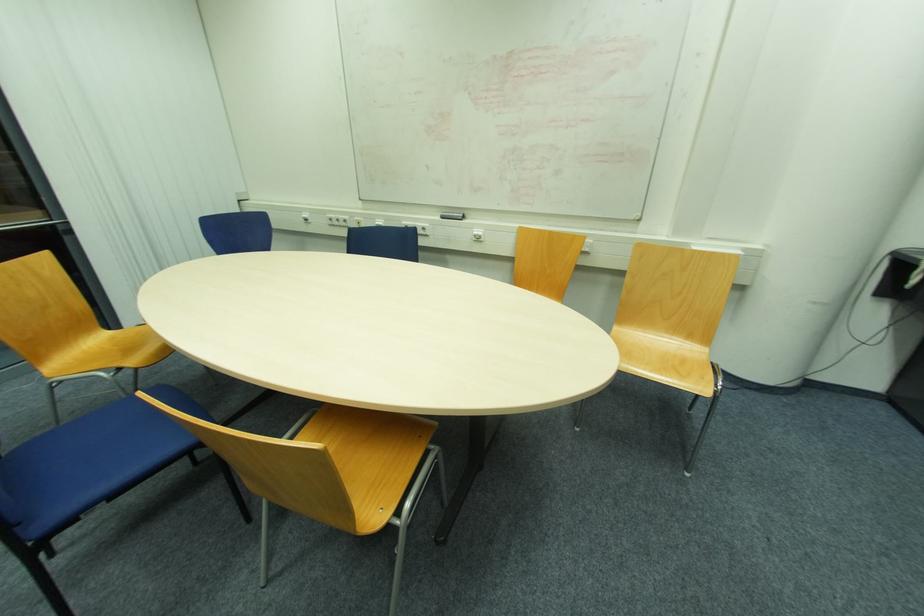
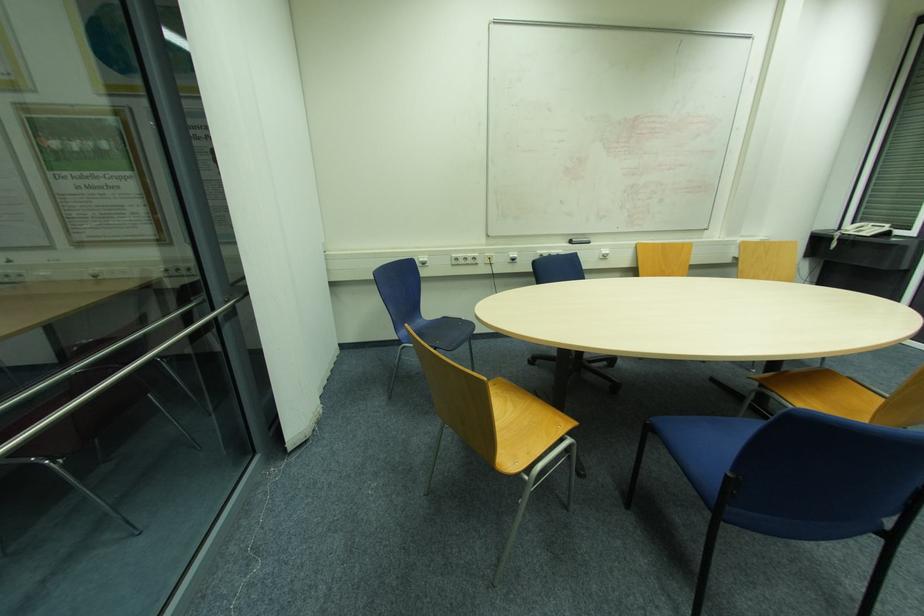
In the second image, find the point that corresponds to pixel 339 221 in the first image.

(467, 259)